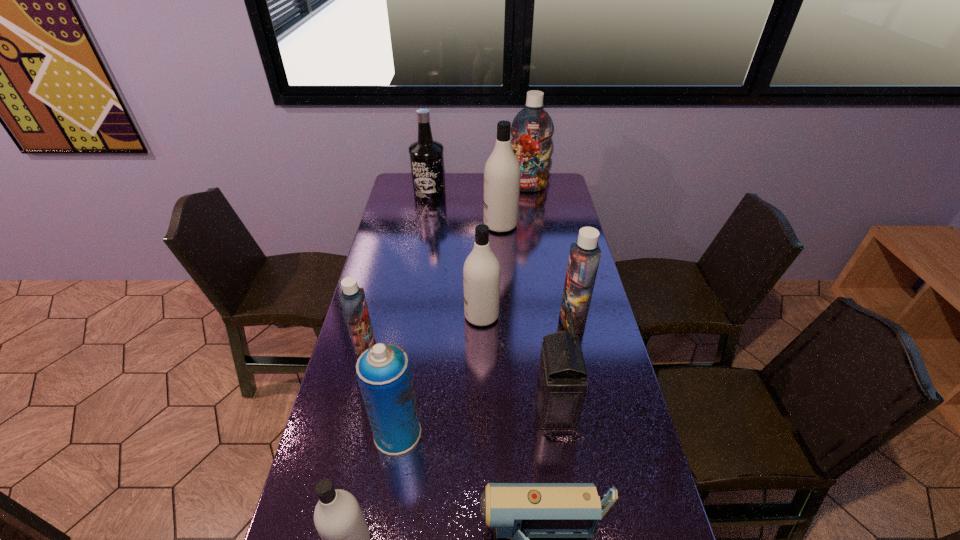
Image resolution: width=960 pixels, height=540 pixels. I want to click on aerosol can present at the left edge, so click(x=383, y=371).

The height and width of the screenshot is (540, 960). In order to click on shampoo located in the left edge section of the desktop in this screenshot , I will do `click(353, 301)`.

At what (x,y) coordinates should I click in order to perform the action: click on lantern at the right edge. Please return your answer as a coordinate pair (x, y). The image size is (960, 540). Looking at the image, I should click on (560, 387).

The height and width of the screenshot is (540, 960). I want to click on object at the far left corner, so click(x=426, y=155).

Identify the location of object at the far right corner. (532, 128).

In the image, there is a desktop. Where is `free space at the left edge`? free space at the left edge is located at coordinates (388, 316).

The image size is (960, 540). What are the coordinates of `free space at the right edge` in the screenshot? It's located at (612, 385).

Where is `free space at the far right corner of the desktop`? free space at the far right corner of the desktop is located at coordinates (556, 176).

Locate an element on the screen. vacant area that lies between the aerosol can and the second farthest white shampoo is located at coordinates (440, 375).

What are the coordinates of `vacant area that lies between the leftmost blue shampoo and the gray lantern` in the screenshot? It's located at (460, 376).